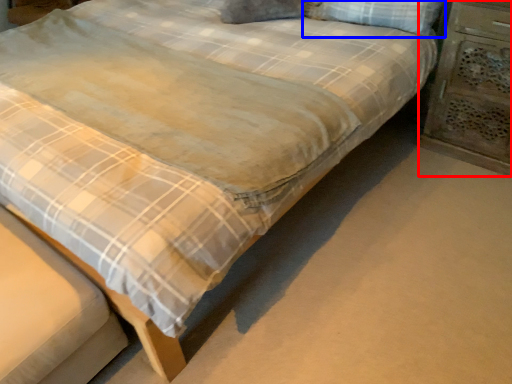
Question: Which object appears farthest to the camera in this image, nightstand (highlighted by a red box) or pillow (highlighted by a blue box)?

Choices:
 (A) nightstand
 (B) pillow

Answer: (B)